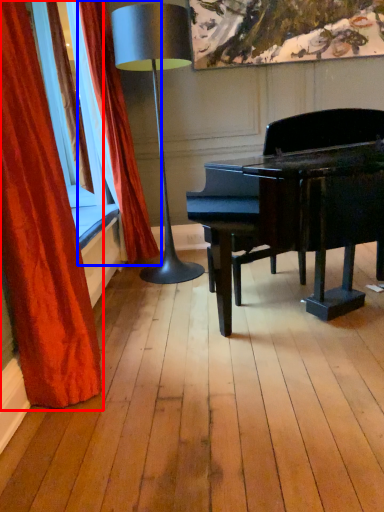
Question: Which of the following is the closest to the observer, curtain (highlighted by a red box) or curtain (highlighted by a blue box)?

Choices:
 (A) curtain
 (B) curtain

Answer: (A)